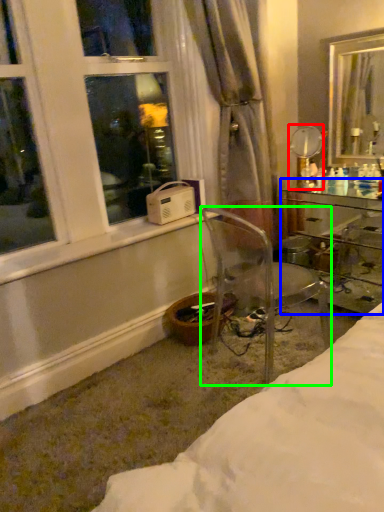
Question: Based on their relative distances, which object is nearer to mirror (highlighted by a red box)? Choose from desk (highlighted by a blue box) and chair (highlighted by a green box).

Choices:
 (A) desk
 (B) chair

Answer: (A)